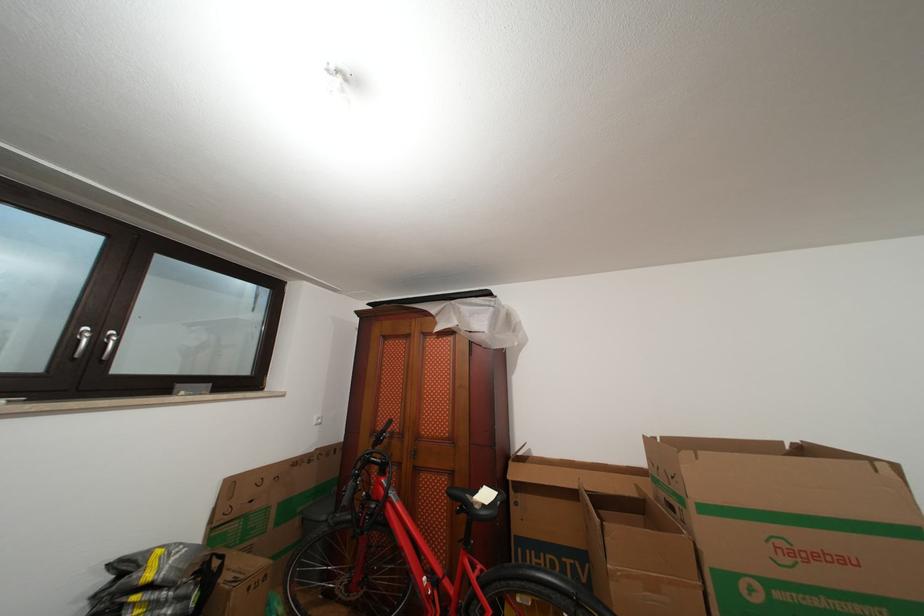
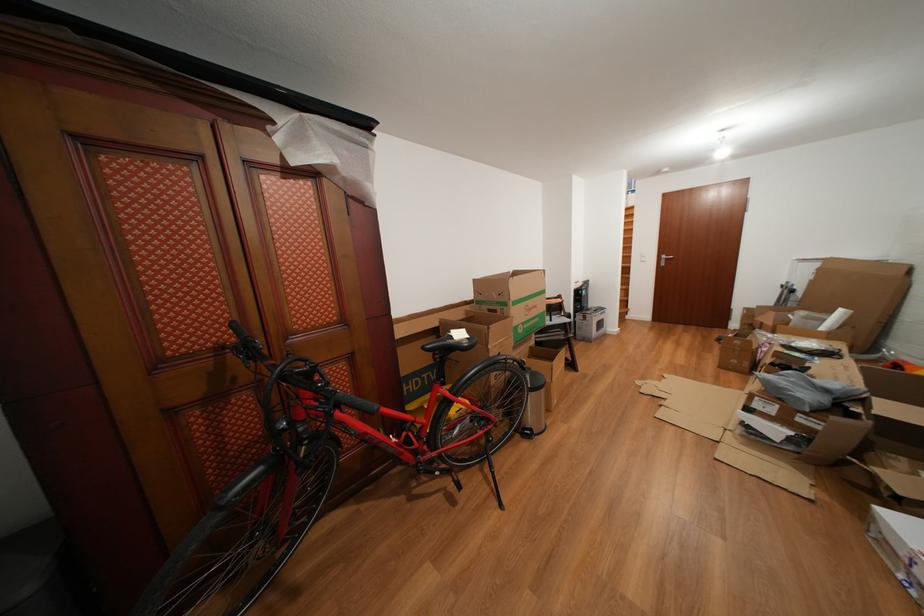
In the second image, find the point that corresponds to (853,565) in the first image.

(543, 312)